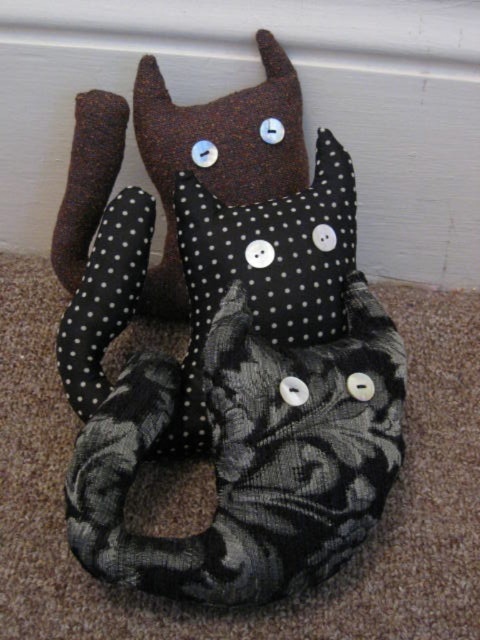
You are organizing a play area and need to place the black dotted fabric cat at center and the black dotted fabric pillow at center on a shelf. If the shelf has limited space, which object should you place first to ensure both fit?

The black dotted fabric pillow at center is smaller, so place it first to accommodate the larger black dotted fabric cat at center.

What are the coordinates of the black dotted fabric cat at center?

The coordinates of the black dotted fabric cat at center are at point [226,342].

Looking at this image, you are trying to decide which object to move first. Since you want to move the wider object first, which one should you choose between the black dotted fabric cat at center and the black dotted fabric pillow at center?

The black dotted fabric cat at center is wider than the black dotted fabric pillow at center, so you should move the black dotted fabric cat at center first.